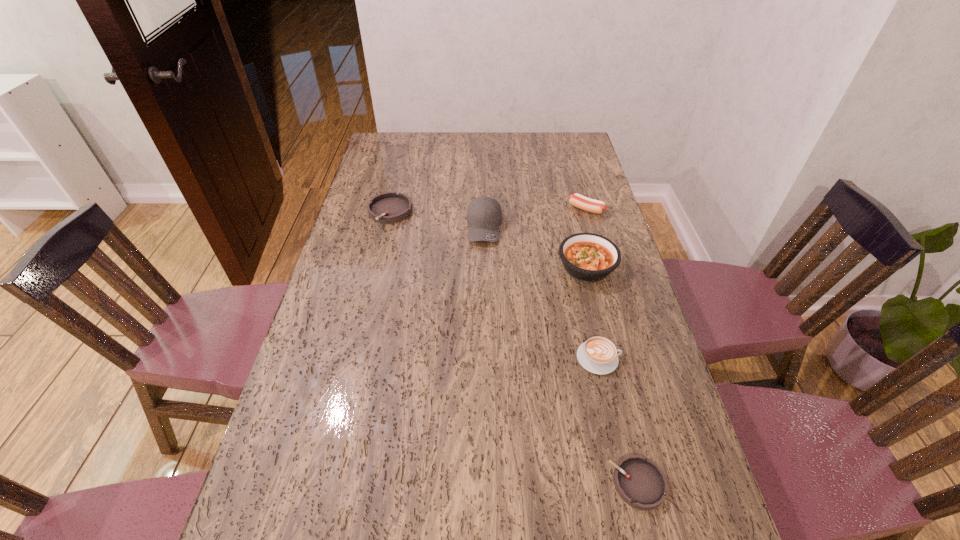
The width and height of the screenshot is (960, 540). I want to click on vacant region between the cappuccino and the sausage, so point(592,284).

The image size is (960, 540). Identify the location of vacant point located between the baseball cap and the sausage. (536, 218).

Where is `empty space between the sausage and the cappuccino`? The image size is (960, 540). empty space between the sausage and the cappuccino is located at coordinates (592, 284).

Locate an element on the screen. The height and width of the screenshot is (540, 960). unoccupied position between the sausage and the baseball cap is located at coordinates (536, 218).

Where is `unoccupied area between the nearer ashtray and the third nearest object`? This screenshot has height=540, width=960. unoccupied area between the nearer ashtray and the third nearest object is located at coordinates coord(612,375).

This screenshot has width=960, height=540. Find the location of `vacant area that lies between the second object from left to right and the nearest object`. vacant area that lies between the second object from left to right and the nearest object is located at coordinates pos(561,355).

Identify the location of object that is the third closest to the baseball cap. The image size is (960, 540). (591, 205).

Image resolution: width=960 pixels, height=540 pixels. Identify the location of object that is the fourth closest to the shortest object. (591, 205).

At what (x,y) coordinates should I click in order to perform the action: click on blank space that satisfies the following two spatial constraints: 1. on the side of the nearest object with the handle; 2. on the left side of the cappuccino. Please return your answer as a coordinate pair (x, y). The height and width of the screenshot is (540, 960). Looking at the image, I should click on (627, 483).

The height and width of the screenshot is (540, 960). Identify the location of free space in the image that satisfies the following two spatial constraints: 1. on the side of the fifth farthest object with the handle; 2. on the left side of the shortest object. (627, 483).